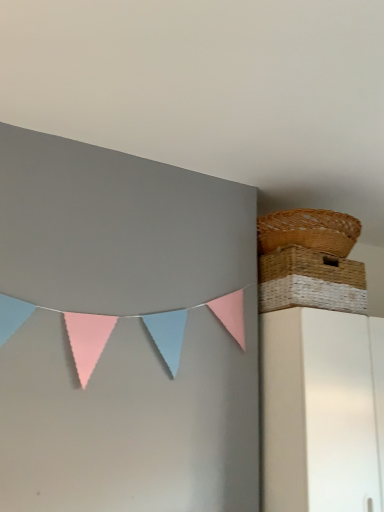
Question: Is woven brown picnic basket at upper right, acting as the first picnic basket starting from the top, with woven straw picnic basket at upper right, placed as the 2th picnic basket when sorted from top to bottom?

Choices:
 (A) no
 (B) yes

Answer: (A)

Question: Can you confirm if woven brown picnic basket at upper right, arranged as the 2th picnic basket when ordered from the bottom, is smaller than woven straw picnic basket at upper right, placed as the 2th picnic basket when sorted from top to bottom?

Choices:
 (A) no
 (B) yes

Answer: (B)

Question: From the image's perspective, is woven brown picnic basket at upper right, arranged as the 2th picnic basket when ordered from the bottom, beneath woven straw picnic basket at upper right, placed as the 2th picnic basket when sorted from top to bottom?

Choices:
 (A) yes
 (B) no

Answer: (B)

Question: Considering the relative sizes of woven brown picnic basket at upper right, acting as the first picnic basket starting from the top, and woven straw picnic basket at upper right, the first picnic basket positioned from the bottom, in the image provided, is woven brown picnic basket at upper right, acting as the first picnic basket starting from the top, wider than woven straw picnic basket at upper right, the first picnic basket positioned from the bottom,?

Choices:
 (A) no
 (B) yes

Answer: (B)

Question: From a real-world perspective, is woven brown picnic basket at upper right, arranged as the 2th picnic basket when ordered from the bottom, positioned under woven straw picnic basket at upper right, the first picnic basket positioned from the bottom, based on gravity?

Choices:
 (A) no
 (B) yes

Answer: (A)

Question: Does woven brown picnic basket at upper right, arranged as the 2th picnic basket when ordered from the bottom, come behind woven straw picnic basket at upper right, the first picnic basket positioned from the bottom?

Choices:
 (A) yes
 (B) no

Answer: (A)

Question: Can woven brown picnic basket at upper right, arranged as the 2th picnic basket when ordered from the bottom, be found inside woven straw picnic basket at upper right, the first picnic basket positioned from the bottom?

Choices:
 (A) no
 (B) yes

Answer: (A)

Question: Considering the relative sizes of woven straw picnic basket at upper right, placed as the 2th picnic basket when sorted from top to bottom, and woven brown picnic basket at upper right, arranged as the 2th picnic basket when ordered from the bottom, in the image provided, is woven straw picnic basket at upper right, placed as the 2th picnic basket when sorted from top to bottom, taller than woven brown picnic basket at upper right, arranged as the 2th picnic basket when ordered from the bottom,?

Choices:
 (A) yes
 (B) no

Answer: (A)

Question: Is woven straw picnic basket at upper right, placed as the 2th picnic basket when sorted from top to bottom, aimed at woven brown picnic basket at upper right, acting as the first picnic basket starting from the top?

Choices:
 (A) yes
 (B) no

Answer: (B)

Question: From a real-world perspective, is woven straw picnic basket at upper right, the first picnic basket positioned from the bottom, physically below woven brown picnic basket at upper right, arranged as the 2th picnic basket when ordered from the bottom?

Choices:
 (A) no
 (B) yes

Answer: (B)

Question: Is woven straw picnic basket at upper right, the first picnic basket positioned from the bottom, with woven brown picnic basket at upper right, acting as the first picnic basket starting from the top?

Choices:
 (A) yes
 (B) no

Answer: (B)

Question: Is woven straw picnic basket at upper right, the first picnic basket positioned from the bottom, at the right side of woven brown picnic basket at upper right, arranged as the 2th picnic basket when ordered from the bottom?

Choices:
 (A) no
 (B) yes

Answer: (A)

Question: From a real-world perspective, is woven straw picnic basket at upper right, the first picnic basket positioned from the bottom, physically located above or below woven brown picnic basket at upper right, acting as the first picnic basket starting from the top?

Choices:
 (A) below
 (B) above

Answer: (A)